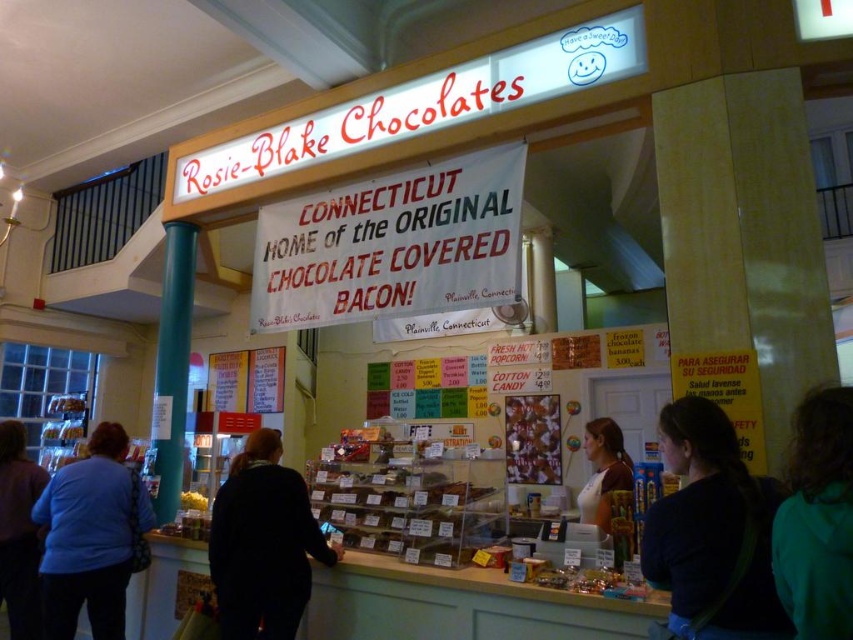
Question: Can you confirm if black fabric at center is positioned above dark blue sweater at lower left?

Choices:
 (A) yes
 (B) no

Answer: (A)

Question: Observing the image, what is the correct spatial positioning of black fabric at center in reference to blue fabric shirt at lower left?

Choices:
 (A) left
 (B) right

Answer: (B)

Question: Which point is farther to the camera?

Choices:
 (A) (724, 424)
 (B) (9, 486)
 (C) (399, 468)
 (D) (231, 496)

Answer: (B)

Question: Is dark green hoodie at lower right wider than brown apron at center?

Choices:
 (A) yes
 (B) no

Answer: (B)

Question: Considering the real-world distances, which object is farthest from the black fabric at center?

Choices:
 (A) translucent plastic chocolate at center
 (B) dark blue fabric at center
 (C) dark green hoodie at lower right
 (D) dark blue sweater at lower left

Answer: (C)

Question: Which point appears closest to the camera in this image?

Choices:
 (A) (753, 586)
 (B) (86, 525)
 (C) (318, 550)
 (D) (9, 476)

Answer: (A)